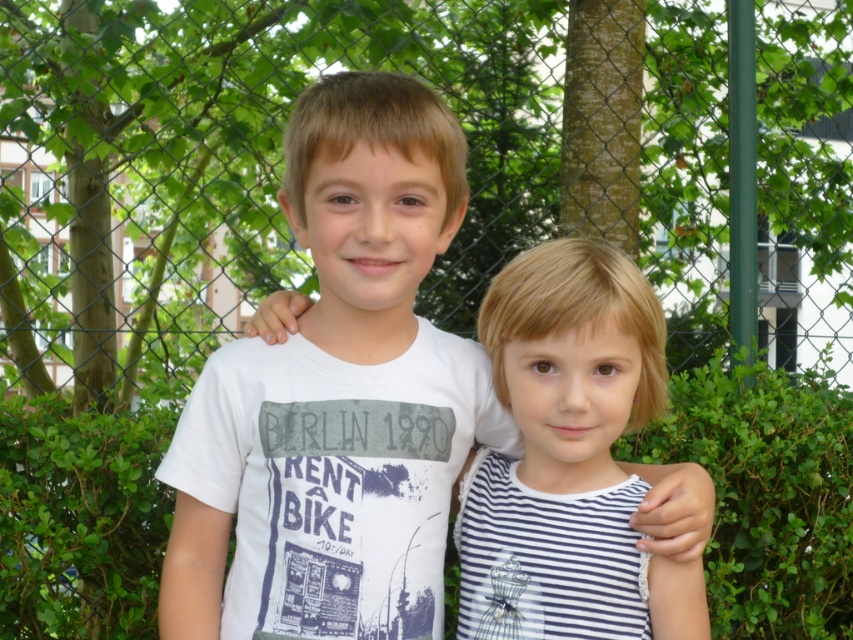
The height and width of the screenshot is (640, 853). Find the location of `metallic chain-link fence at upper center`. metallic chain-link fence at upper center is located at coordinates (467, 166).

Can you confirm if metallic chain-link fence at upper center is shorter than white cotton shirt at center?

Incorrect, metallic chain-link fence at upper center's height does not fall short of white cotton shirt at center's.

This screenshot has height=640, width=853. What do you see at coordinates (467, 166) in the screenshot?
I see `metallic chain-link fence at upper center` at bounding box center [467, 166].

Find the location of a particular element. The image size is (853, 640). metallic chain-link fence at upper center is located at coordinates (467, 166).

Can you confirm if metallic chain-link fence at upper center is positioned above white striped dress at center?

Indeed, metallic chain-link fence at upper center is positioned over white striped dress at center.

You are a GUI agent. You are given a task and a screenshot of the screen. Output one action in this format:
    pyautogui.click(x=<x>, y=<y>)
    Task: Click on the metallic chain-link fence at upper center
    
    Given the screenshot: What is the action you would take?
    pyautogui.click(x=467, y=166)

Find the location of a particular element. The image size is (853, 640). metallic chain-link fence at upper center is located at coordinates (467, 166).

Which of these two, white cotton shirt at center or green leafy hedge at center, stands shorter?

With less height is green leafy hedge at center.

Measure the distance between white cotton shirt at center and green leafy hedge at center.

white cotton shirt at center and green leafy hedge at center are 28.25 inches apart from each other.

Between point (314, 202) and point (55, 589), which one is positioned in front?

Point (314, 202)

I want to click on white cotton shirt at center, so (337, 396).